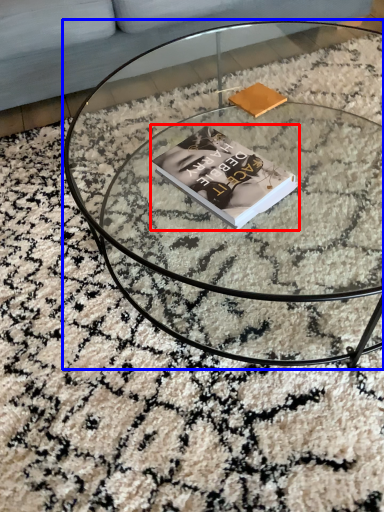
Question: Which of the following is the farthest to the observer, book (highlighted by a red box) or coffee table (highlighted by a blue box)?

Choices:
 (A) book
 (B) coffee table

Answer: (A)